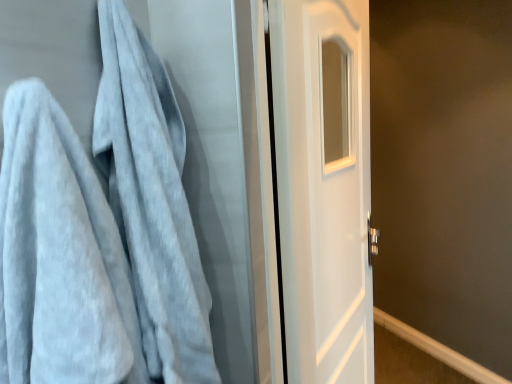
Question: In terms of width, does light gray plush towel at left look wider or thinner when compared to white glossy door at center?

Choices:
 (A) wide
 (B) thin

Answer: (A)

Question: Choose the correct answer: Is light gray plush towel at left inside white glossy door at center or outside it?

Choices:
 (A) inside
 (B) outside

Answer: (B)

Question: Is light gray plush towel at left in front of or behind white glossy door at center in the image?

Choices:
 (A) front
 (B) behind

Answer: (A)

Question: Is white glossy door at center in front of or behind light gray plush towel at left in the image?

Choices:
 (A) behind
 (B) front

Answer: (A)

Question: Is white glossy door at center spatially inside light gray plush towel at left, or outside of it?

Choices:
 (A) inside
 (B) outside

Answer: (B)

Question: Considering the relative positions of white glossy door at center and light gray plush towel at left in the image provided, is white glossy door at center to the left or to the right of light gray plush towel at left?

Choices:
 (A) right
 (B) left

Answer: (A)

Question: Looking at the image, does white glossy door at center seem bigger or smaller compared to light gray plush towel at left?

Choices:
 (A) small
 (B) big

Answer: (B)